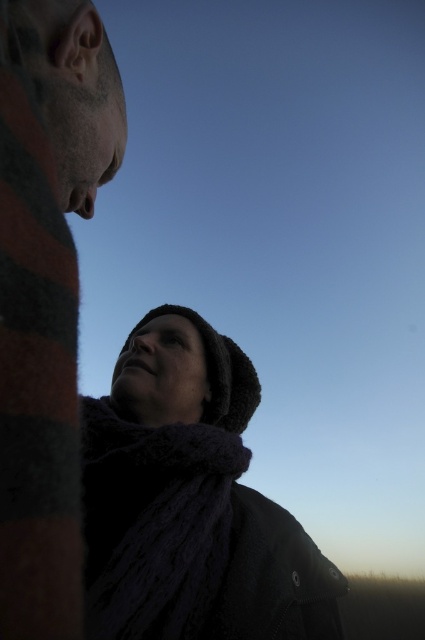
Where is `striped wool scarf at left`? striped wool scarf at left is located at coordinates (47, 296).

Which is more to the left, striped wool scarf at left or dark woolen scarf at lower center?

striped wool scarf at left is more to the left.

Image resolution: width=425 pixels, height=640 pixels. What are the coordinates of `striped wool scarf at left` in the screenshot? It's located at (47, 296).

Find the location of a particular element. The image size is (425, 640). striped wool scarf at left is located at coordinates (47, 296).

Which is more to the left, knitted wool scarf at lower left or striped wool scarf at left?

From the viewer's perspective, striped wool scarf at left appears more on the left side.

The width and height of the screenshot is (425, 640). Identify the location of knitted wool scarf at lower left. (189, 500).

Between knitted wool scarf at lower left and dark woolen scarf at lower center, which one appears on the left side from the viewer's perspective?

dark woolen scarf at lower center

Which is behind, point (237, 579) or point (102, 460)?

Positioned behind is point (102, 460).

This screenshot has width=425, height=640. What do you see at coordinates (189, 500) in the screenshot?
I see `knitted wool scarf at lower left` at bounding box center [189, 500].

The width and height of the screenshot is (425, 640). What are the coordinates of `knitted wool scarf at lower left` in the screenshot? It's located at (189, 500).